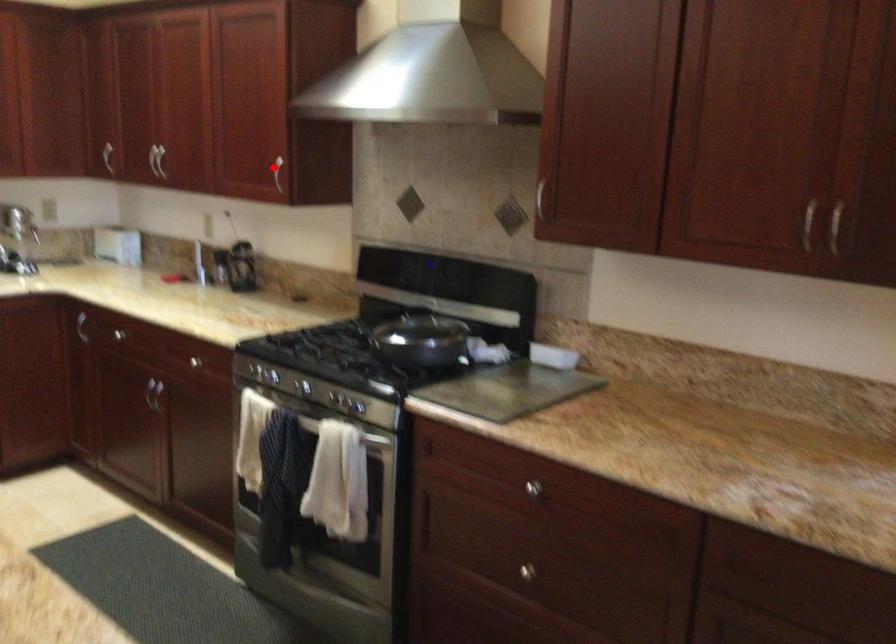
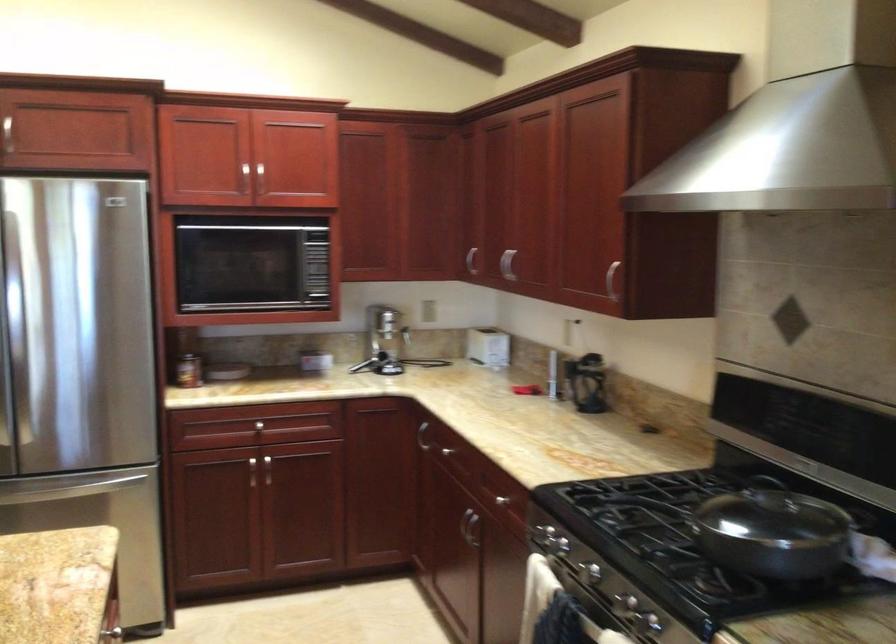
In the second image, find the point that corresponds to the highlighted location in the first image.

(612, 279)